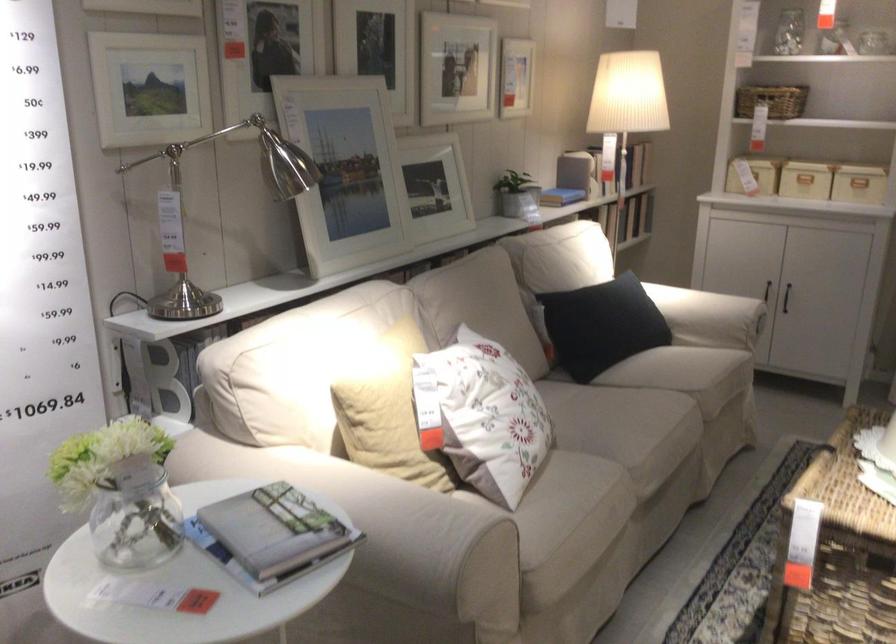
Where is `blue book`? The width and height of the screenshot is (896, 644). blue book is located at coordinates (561, 194).